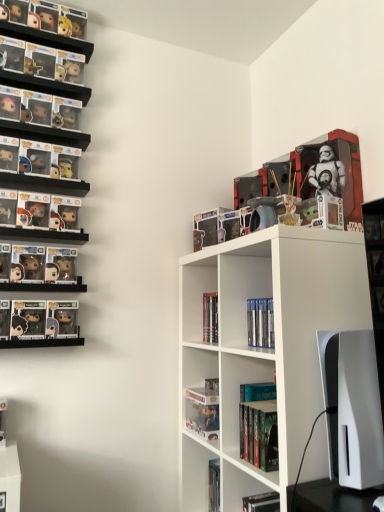
What do you see at coordinates (260, 323) in the screenshot? I see `hardcover book at center, which is the 4th book from bottom to top` at bounding box center [260, 323].

Find the location of a particular element. hardcover book at center, arranged as the 2th book when viewed from the top is located at coordinates (260, 323).

In the scene shown: Is hardcover book at lower center, placed as the 5th book when sorted from top to bottom, smaller than white glossy monitor at right?

Yes.

Does hardcover book at lower center, placed as the 5th book when sorted from top to bottom, come behind white glossy monitor at right?

Yes, it is behind white glossy monitor at right.

This screenshot has width=384, height=512. I want to click on book that is the 1st one when counting backward from the white glossy monitor at right, so coord(262,502).

Are hardcover book at lower center, placed as the 5th book when sorted from top to bottom, and white glossy monitor at right beside each other?

A: hardcover book at lower center, placed as the 5th book when sorted from top to bottom, is not next to white glossy monitor at right, and they're not touching.

Can you confirm if white glossy monitor at right is positioned to the left of hardcover book at center, placed as the 3th book when sorted from bottom to top?

In fact, white glossy monitor at right is to the right of hardcover book at center, placed as the 3th book when sorted from bottom to top.

Which object is closer to the camera taking this photo, white glossy monitor at right or hardcover book at center, which ranks as the 3th book in top-to-bottom order?

white glossy monitor at right.

Is white glossy monitor at right far away from hardcover book at center, placed as the 3th book when sorted from bottom to top?

No, white glossy monitor at right is not far away from hardcover book at center, placed as the 3th book when sorted from bottom to top.

From the image's perspective, starting from the white glossy monitor at right, which book is the 1st one below? Please provide its 2D coordinates.

[(259, 425)]

Is clear plastic book at upper center, which is the 1th book in top-to-bottom order, aimed at hardcover book at lower center, placed as the 5th book when sorted from top to bottom?

No.

From a real-world perspective, is clear plastic book at upper center, which is the fifth book in bottom-to-top order, physically located above or below hardcover book at lower center, which is the 1th book in bottom-to-top order?

clear plastic book at upper center, which is the fifth book in bottom-to-top order, is situated higher than hardcover book at lower center, which is the 1th book in bottom-to-top order, in the real world.

Is clear plastic book at upper center, which is the 1th book in top-to-bottom order, directly adjacent to hardcover book at lower center, which is the 1th book in bottom-to-top order?

No, clear plastic book at upper center, which is the 1th book in top-to-bottom order, is not next to hardcover book at lower center, which is the 1th book in bottom-to-top order.

Can you confirm if clear plastic book at upper center, which is the 1th book in top-to-bottom order, is positioned to the right of hardcover book at lower center, which is the 1th book in bottom-to-top order?

No, clear plastic book at upper center, which is the 1th book in top-to-bottom order, is not to the right of hardcover book at lower center, which is the 1th book in bottom-to-top order.

In terms of height, does hardcover book at lower center, placed as the 5th book when sorted from top to bottom, look taller or shorter compared to clear plastic figure at lower center, arranged as the second book when ordered from the bottom?

Clearly, hardcover book at lower center, placed as the 5th book when sorted from top to bottom, is taller compared to clear plastic figure at lower center, arranged as the second book when ordered from the bottom.

Does hardcover book at lower center, which is the 1th book in bottom-to-top order, turn towards clear plastic figure at lower center, arranged as the second book when ordered from the bottom?

No, hardcover book at lower center, which is the 1th book in bottom-to-top order, is not oriented towards clear plastic figure at lower center, arranged as the second book when ordered from the bottom.

Is hardcover book at lower center, placed as the 5th book when sorted from top to bottom, behind clear plastic figure at lower center, arranged as the second book when ordered from the bottom?

No, hardcover book at lower center, placed as the 5th book when sorted from top to bottom, is closer to the viewer.

Is clear plastic figure at lower center, arranged as the second book when ordered from the bottom, bigger or smaller than white glossy monitor at right?

clear plastic figure at lower center, arranged as the second book when ordered from the bottom, is smaller than white glossy monitor at right.

At what (x,y) coordinates should I click in order to perform the action: click on book that is the 5th one when counting leftward from the white glossy monitor at right. Please return your answer as a coordinate pair (x, y). The height and width of the screenshot is (512, 384). Looking at the image, I should click on (203, 409).

Is clear plastic figure at lower center, which is counted as the fourth book, starting from the top, wider than white glossy monitor at right?

Incorrect, the width of clear plastic figure at lower center, which is counted as the fourth book, starting from the top, does not surpass that of white glossy monitor at right.

Can you tell me how much clear plastic figure at lower center, which is counted as the fourth book, starting from the top, and white glossy monitor at right differ in facing direction?

2.88 degrees separate the facing orientations of clear plastic figure at lower center, which is counted as the fourth book, starting from the top, and white glossy monitor at right.

Looking at this image, considering the relative positions of hardcover book at center, which ranks as the 3th book in top-to-bottom order, and hardcover book at lower center, placed as the 5th book when sorted from top to bottom, in the image provided, is hardcover book at center, which ranks as the 3th book in top-to-bottom order, in front of hardcover book at lower center, placed as the 5th book when sorted from top to bottom,?

No, hardcover book at center, which ranks as the 3th book in top-to-bottom order, is behind hardcover book at lower center, placed as the 5th book when sorted from top to bottom.

Considering the sizes of objects hardcover book at center, which ranks as the 3th book in top-to-bottom order, and hardcover book at lower center, which is the 1th book in bottom-to-top order, in the image provided, who is taller, hardcover book at center, which ranks as the 3th book in top-to-bottom order, or hardcover book at lower center, which is the 1th book in bottom-to-top order,?

Standing taller between the two is hardcover book at center, which ranks as the 3th book in top-to-bottom order.

Considering the sizes of hardcover book at center, placed as the 3th book when sorted from bottom to top, and hardcover book at lower center, which is the 1th book in bottom-to-top order, in the image, is hardcover book at center, placed as the 3th book when sorted from bottom to top, bigger or smaller than hardcover book at lower center, which is the 1th book in bottom-to-top order,?

hardcover book at center, placed as the 3th book when sorted from bottom to top, is smaller than hardcover book at lower center, which is the 1th book in bottom-to-top order.

From a real-world perspective, is hardcover book at center, arranged as the 2th book when viewed from the top, positioned under white glossy monitor at right based on gravity?

No, from a real-world perspective, hardcover book at center, arranged as the 2th book when viewed from the top, is not below white glossy monitor at right.

How far apart are hardcover book at center, arranged as the 2th book when viewed from the top, and white glossy monitor at right?

hardcover book at center, arranged as the 2th book when viewed from the top, and white glossy monitor at right are 12.15 inches apart from each other.

Is hardcover book at center, arranged as the 2th book when viewed from the top, shorter than white glossy monitor at right?

Correct, hardcover book at center, arranged as the 2th book when viewed from the top, is not as tall as white glossy monitor at right.

Can you confirm if hardcover book at center, which is the 4th book from bottom to top, is positioned to the left of white glossy monitor at right?

Yes.

Locate an element on the screen. book that is the 3rd object located below the white glossy monitor at right (from the image's perspective) is located at coordinates (262, 502).

Find the location of a particular element. The width and height of the screenshot is (384, 512). computer monitor lying in front of the hardcover book at center, placed as the 3th book when sorted from bottom to top is located at coordinates (352, 407).

Looking at the image, which one is located closer to white glossy monitor at right, white matte shelf at center or hardcover book at center, which ranks as the 3th book in top-to-bottom order?

The object closer to white glossy monitor at right is hardcover book at center, which ranks as the 3th book in top-to-bottom order.

Looking at the image, which one is located further to white glossy monitor at right, clear plastic book at upper center, which is the fifth book in bottom-to-top order, or hardcover book at lower center, placed as the 5th book when sorted from top to bottom?

clear plastic book at upper center, which is the fifth book in bottom-to-top order, is further to white glossy monitor at right.

Estimate the real-world distances between objects in this image. Which object is further from clear plastic figure at lower center, arranged as the second book when ordered from the bottom, clear plastic book at upper center, which is the fifth book in bottom-to-top order, or white glossy monitor at right?

The object further to clear plastic figure at lower center, arranged as the second book when ordered from the bottom, is clear plastic book at upper center, which is the fifth book in bottom-to-top order.

From the image, which object appears to be nearer to white glossy monitor at right, hardcover book at lower center, placed as the 5th book when sorted from top to bottom, or clear plastic book at upper center, which is the fifth book in bottom-to-top order?

Based on the image, hardcover book at lower center, placed as the 5th book when sorted from top to bottom, appears to be nearer to white glossy monitor at right.

Which object lies nearer to the anchor point hardcover book at center, which is the 4th book from bottom to top, hardcover book at center, which ranks as the 3th book in top-to-bottom order, or white glossy monitor at right?

Among the two, hardcover book at center, which ranks as the 3th book in top-to-bottom order, is located nearer to hardcover book at center, which is the 4th book from bottom to top.

Estimate the real-world distances between objects in this image. Which object is further from white matte shelf at center, hardcover book at center, which is the 4th book from bottom to top, or clear plastic book at upper center, which is the fifth book in bottom-to-top order?

clear plastic book at upper center, which is the fifth book in bottom-to-top order.

Estimate the real-world distances between objects in this image. Which object is further from clear plastic book at upper center, which is the 1th book in top-to-bottom order, hardcover book at lower center, placed as the 5th book when sorted from top to bottom, or clear plastic figure at lower center, which is counted as the fourth book, starting from the top?

hardcover book at lower center, placed as the 5th book when sorted from top to bottom, is positioned further to the anchor clear plastic book at upper center, which is the 1th book in top-to-bottom order.

Based on their spatial positions, is clear plastic figure at lower center, arranged as the second book when ordered from the bottom, or hardcover book at center, arranged as the 2th book when viewed from the top, further from hardcover book at center, which ranks as the 3th book in top-to-bottom order?

hardcover book at center, arranged as the 2th book when viewed from the top, lies further to hardcover book at center, which ranks as the 3th book in top-to-bottom order, than the other object.

This screenshot has height=512, width=384. Find the location of `shelf between white glossy monitor at right and hardcover book at lower center, placed as the 5th book when sorted from top to bottom, in the up-down direction`. shelf between white glossy monitor at right and hardcover book at lower center, placed as the 5th book when sorted from top to bottom, in the up-down direction is located at coordinates (264, 348).

What are the coordinates of `shelf between white glossy monitor at right and clear plastic book at upper center, which is the 1th book in top-to-bottom order, in the front-back direction` in the screenshot? It's located at (264, 348).

Where is `shelf that lies between clear plastic book at upper center, which is the 1th book in top-to-bottom order, and hardcover book at lower center, which is the 1th book in bottom-to-top order, from top to bottom`? shelf that lies between clear plastic book at upper center, which is the 1th book in top-to-bottom order, and hardcover book at lower center, which is the 1th book in bottom-to-top order, from top to bottom is located at coordinates (264, 348).

Image resolution: width=384 pixels, height=512 pixels. In order to click on shelf between white glossy monitor at right and hardcover book at center, which ranks as the 3th book in top-to-bottom order, from front to back in this screenshot , I will do `click(264, 348)`.